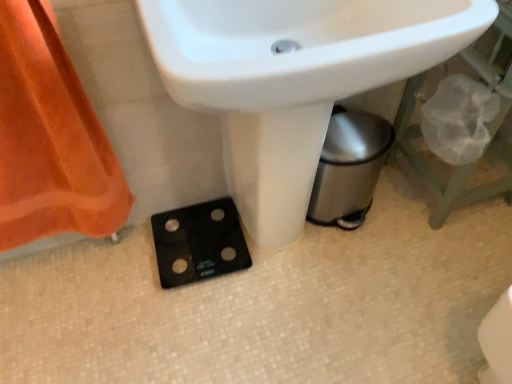
The height and width of the screenshot is (384, 512). I want to click on vacant region to the left of black glass scale at lower center, so (x=121, y=262).